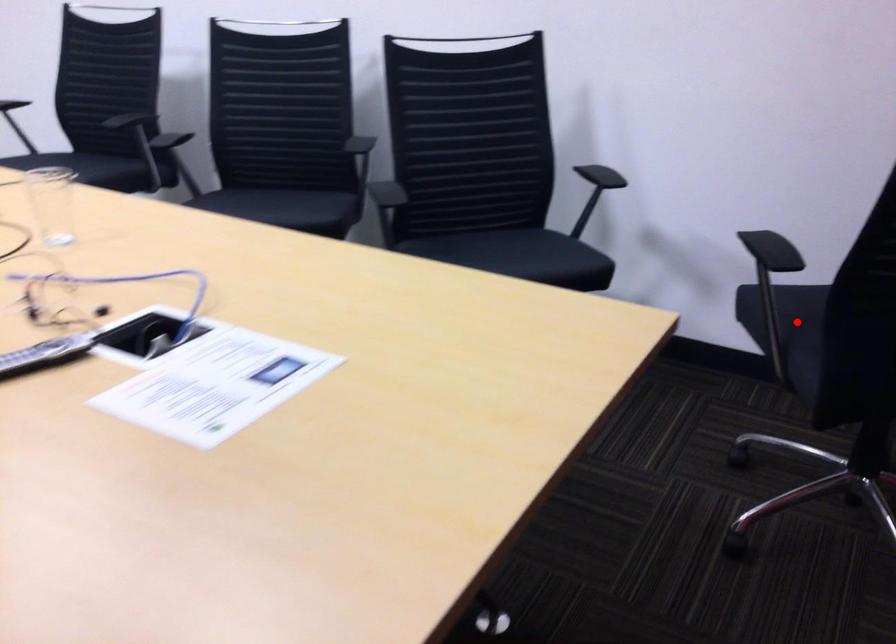
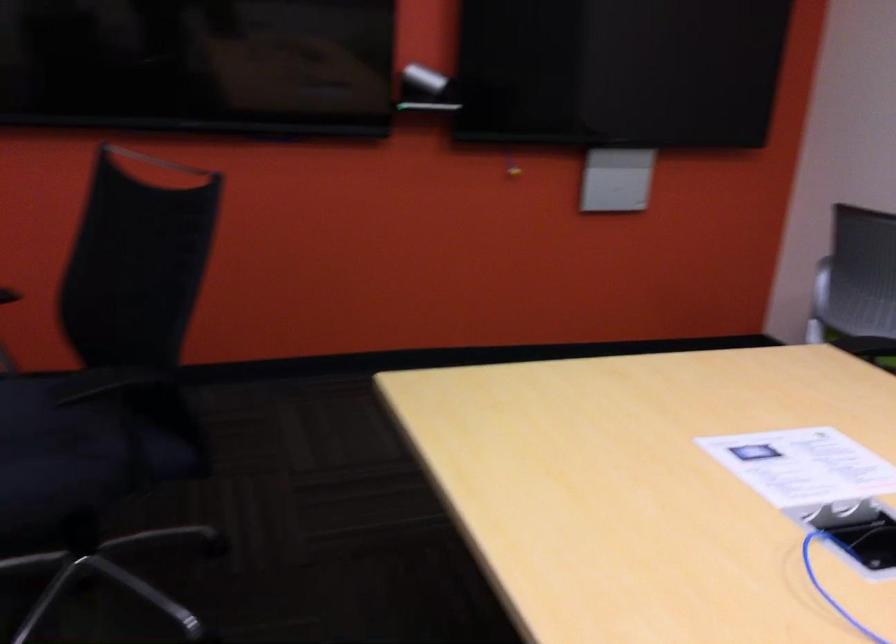
Question: I am providing you with two images of the same scene from different viewpoints. Image1 has a red point marked. In image2, the corresponding 3D location appears at what relative position? Reply with the corresponding letter.

Choices:
 (A) Closer
 (B) Farther

Answer: (A)